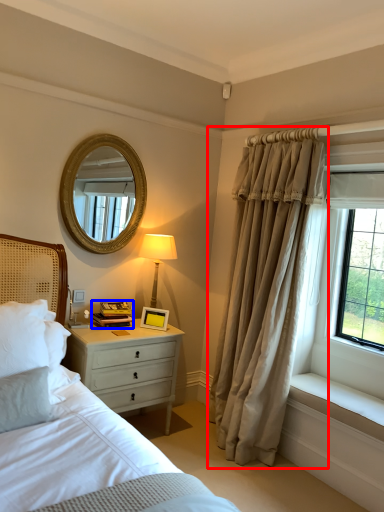
Question: Which object is closer to the camera taking this photo, curtain (highlighted by a red box) or book (highlighted by a blue box)?

Choices:
 (A) curtain
 (B) book

Answer: (A)